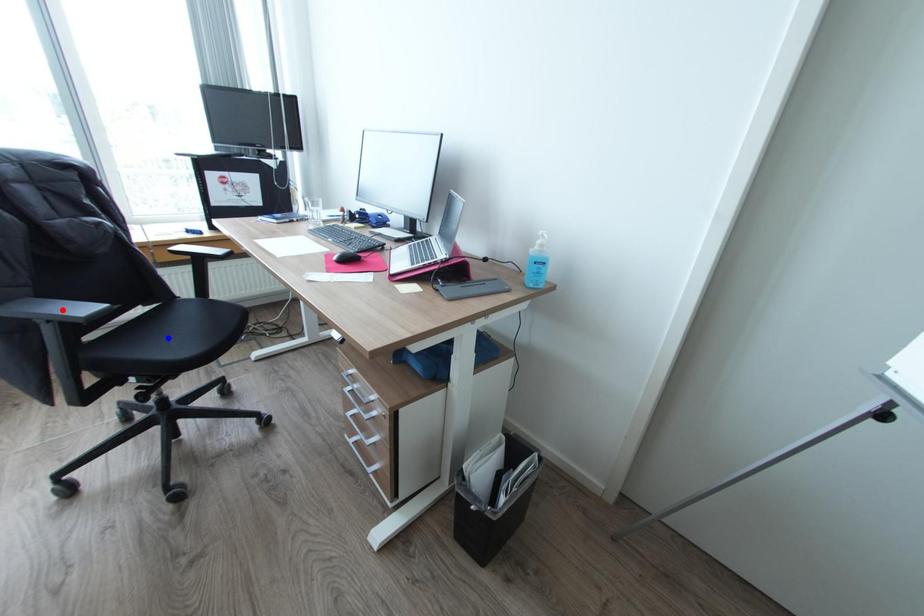
Question: Which of the two points in the image is closer to the camera?

Choices:
 (A) Blue point is closer.
 (B) Red point is closer.

Answer: (B)